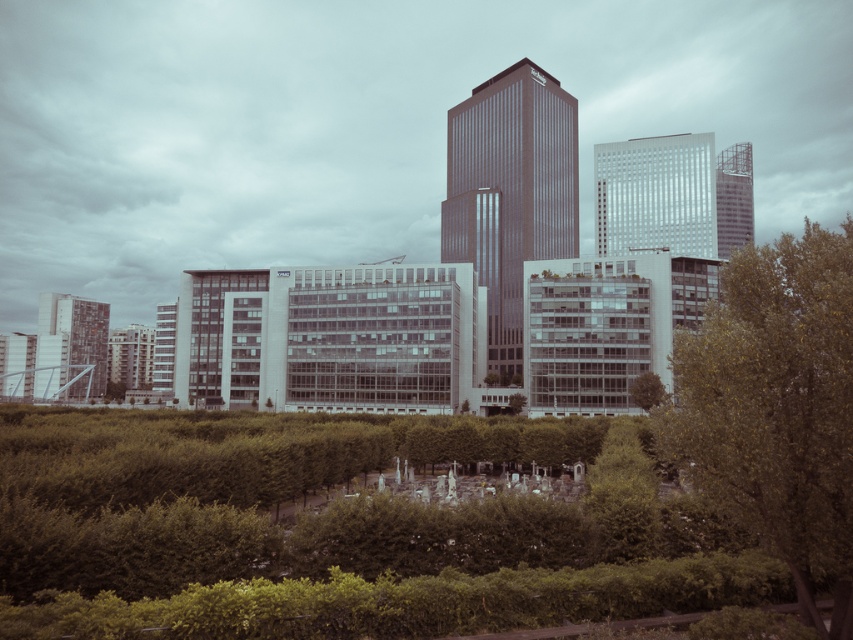
You are standing in the cityscape scene and want to determine which of the two points, point [776,305] or point [79,387], is nearer to you. Based on the description, which point is closer?

Point [776,305] is closer to the viewer than point [79,387].

You are standing at point (775, 406) in the cityscape. What object is located at this point?

The point (775, 406) is occupied by a green leafy tree at center.

You are standing in the cityscape scene and want to determine the relative positions of two points. Which point, point (511, 272) or point (726, 209), is nearer to you?

Point (511, 272) is closer to the viewer than point (726, 209).